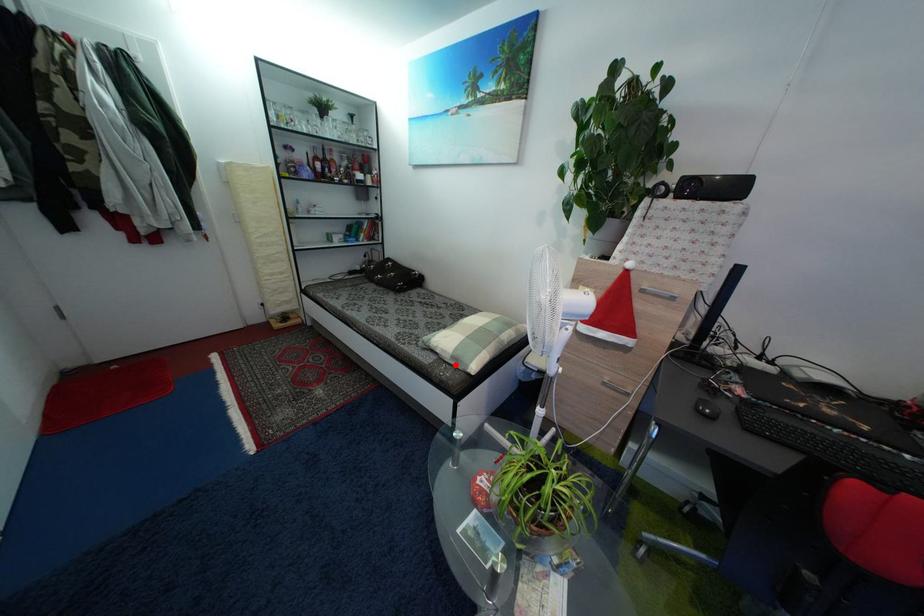
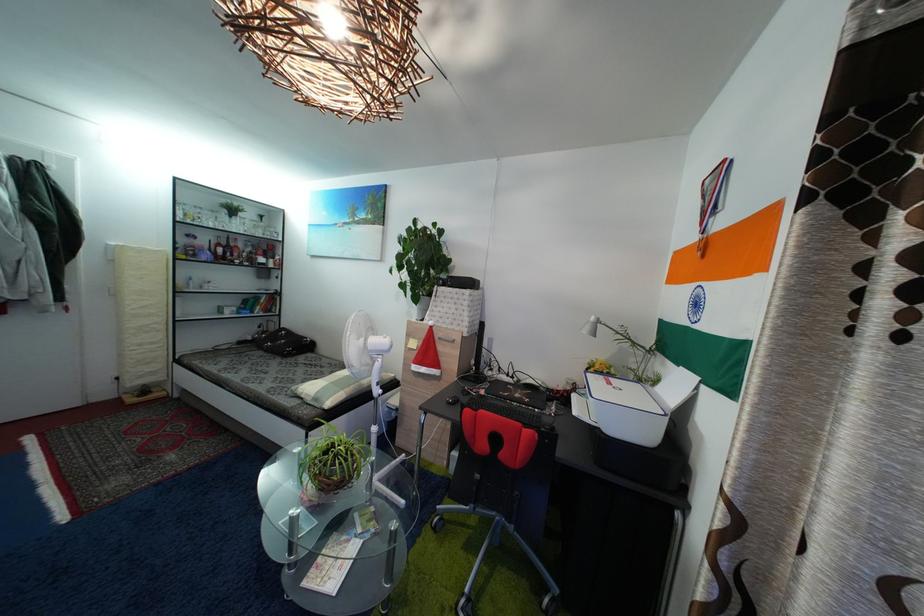
Where in the second image is the point corresponding to the highlighted location from the first image?

(318, 407)